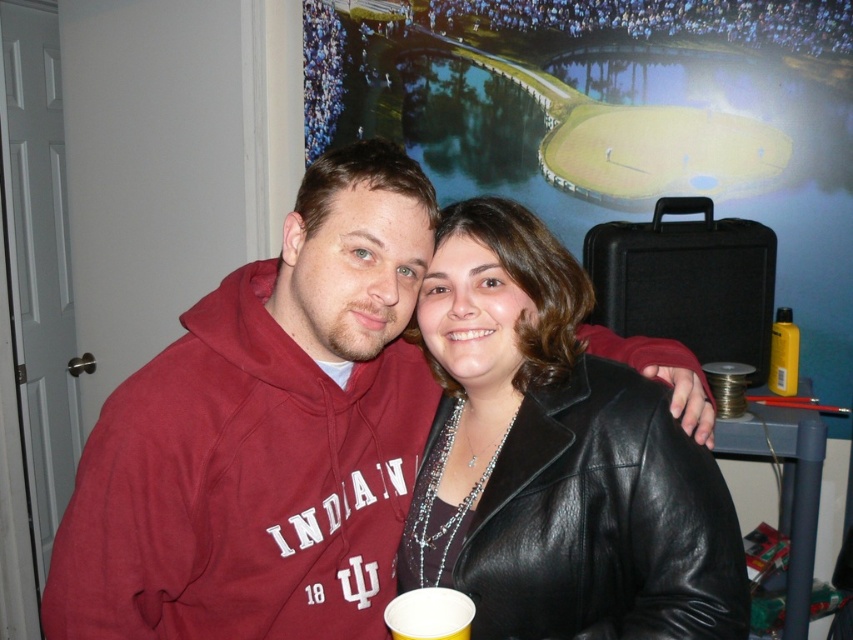
Question: Considering the real-world distances, which object is farthest from the maroon hoodie at center?

Choices:
 (A) white paper cup at lower center
 (B) black leather jacket at center

Answer: (A)

Question: Which object is farther from the camera taking this photo?

Choices:
 (A) black leather jacket at center
 (B) white paper cup at lower center
 (C) maroon hoodie at center

Answer: (C)

Question: Does black leather jacket at center appear over white paper cup at lower center?

Choices:
 (A) no
 (B) yes

Answer: (B)

Question: Can you confirm if maroon hoodie at center is bigger than black leather jacket at center?

Choices:
 (A) yes
 (B) no

Answer: (A)

Question: Which point is closer to the camera?

Choices:
 (A) white paper cup at lower center
 (B) black leather jacket at center

Answer: (A)

Question: Does maroon hoodie at center appear on the right side of black leather jacket at center?

Choices:
 (A) no
 (B) yes

Answer: (A)